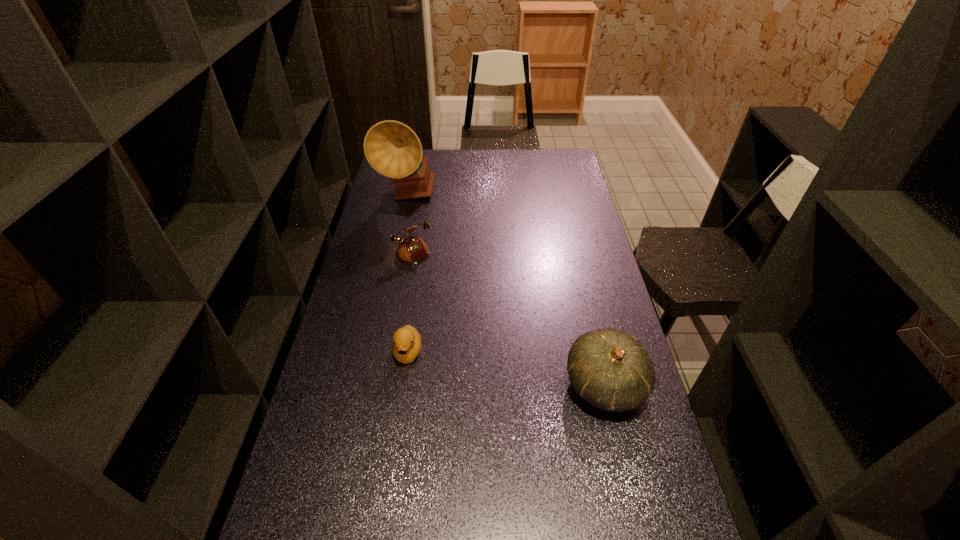
This screenshot has width=960, height=540. Identify the location of duckling. (406, 346).

Locate an element on the screen. This screenshot has height=540, width=960. the rightmost object is located at coordinates (611, 370).

The height and width of the screenshot is (540, 960). Identify the location of the second tallest object. (611, 370).

You are a GUI agent. You are given a task and a screenshot of the screen. Output one action in this format:
    pyautogui.click(x=<x>, y=<y>)
    Task: Click on the third nearest object
    
    Given the screenshot: What is the action you would take?
    pyautogui.click(x=413, y=250)

Locate an element on the screen. This screenshot has width=960, height=540. the tallest object is located at coordinates point(393,149).

This screenshot has width=960, height=540. I want to click on phonograph record, so click(393, 149).

What are the coordinates of `free space located 0.360m on the face of the duckling` in the screenshot? It's located at (387, 503).

Where is `free space located on the left of the second tallest object`? Image resolution: width=960 pixels, height=540 pixels. free space located on the left of the second tallest object is located at coordinates (500, 385).

The width and height of the screenshot is (960, 540). I want to click on vacant space situated 0.370m on the rotary dial of the third nearest object, so click(472, 357).

At what (x,y) coordinates should I click in order to perform the action: click on vacant space located on the rotary dial of the third nearest object. Please return your answer as a coordinate pair (x, y). Looking at the image, I should click on (472, 357).